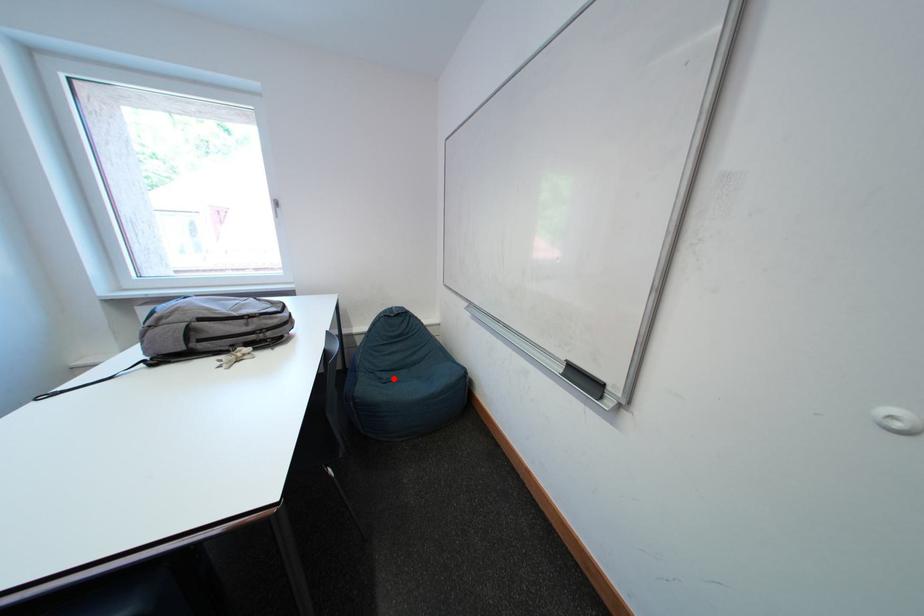
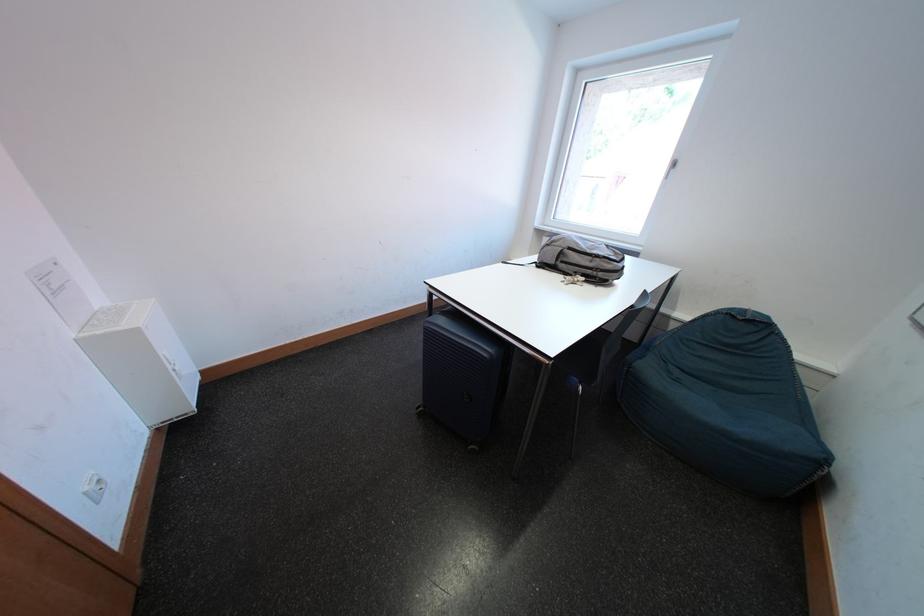
Locate, in the second image, the point that corresponds to the highlighted location in the first image.

(687, 376)